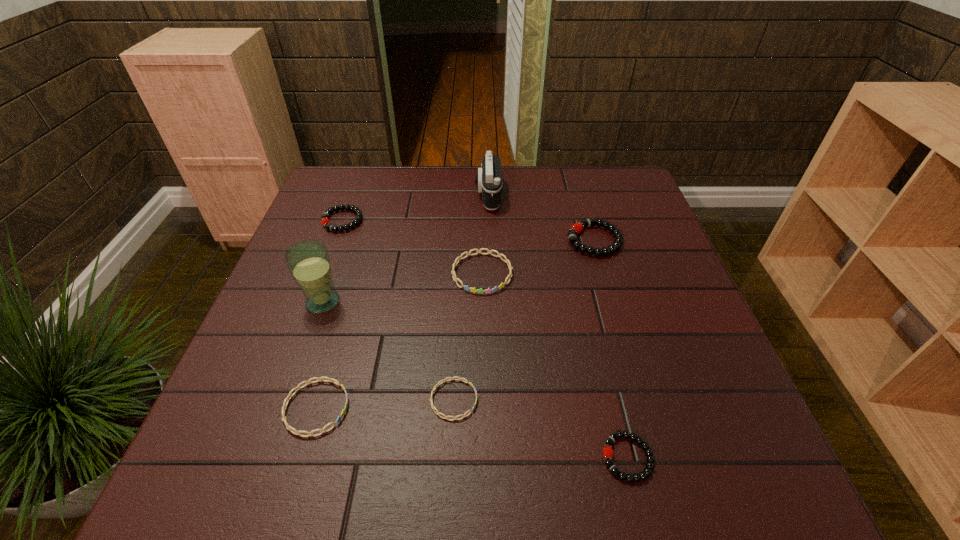
Where is `vacant area at the far right corner`? The image size is (960, 540). vacant area at the far right corner is located at coordinates (601, 178).

Locate an element on the screen. vacant space that's between the farthest blue bracelet and the camera is located at coordinates (485, 234).

Find the location of a particular element. Image resolution: width=960 pixels, height=540 pixels. blank region between the leftmost black bracelet and the leftmost blue bracelet is located at coordinates (329, 314).

Where is `free space between the camera and the nearest black bracelet`? The height and width of the screenshot is (540, 960). free space between the camera and the nearest black bracelet is located at coordinates (558, 326).

You are a GUI agent. You are given a task and a screenshot of the screen. Output one action in this format:
    pyautogui.click(x=<x>, y=<y>)
    Task: Click on the vacant space that is in between the second tallest object and the biggest black bracelet
    The image size is (960, 540).
    Given the screenshot: What is the action you would take?
    pyautogui.click(x=541, y=218)

The height and width of the screenshot is (540, 960). Identify the location of free space that is in between the biggest black bracelet and the biggest blue bracelet. (539, 256).

This screenshot has width=960, height=540. Identify the location of free space that is in between the blue glass and the second smallest blue bracelet. (320, 355).

Locate an element on the screen. vacant area between the blue glass and the shortest bracelet is located at coordinates (388, 350).

Locate an element on the screen. Image resolution: width=960 pixels, height=540 pixels. empty space between the seventh shortest object and the biggest black bracelet is located at coordinates (541, 218).

I want to click on free area in between the farthest blue bracelet and the leftmost black bracelet, so pos(412,247).